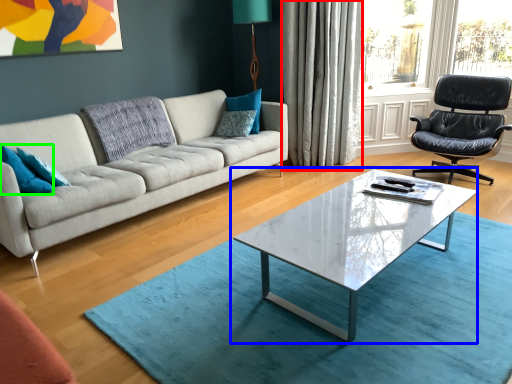
Question: Based on their relative distances, which object is farther from curtain (highlighted by a red box)? Choose from coffee table (highlighted by a blue box) and pillow (highlighted by a green box).

Choices:
 (A) coffee table
 (B) pillow

Answer: (B)